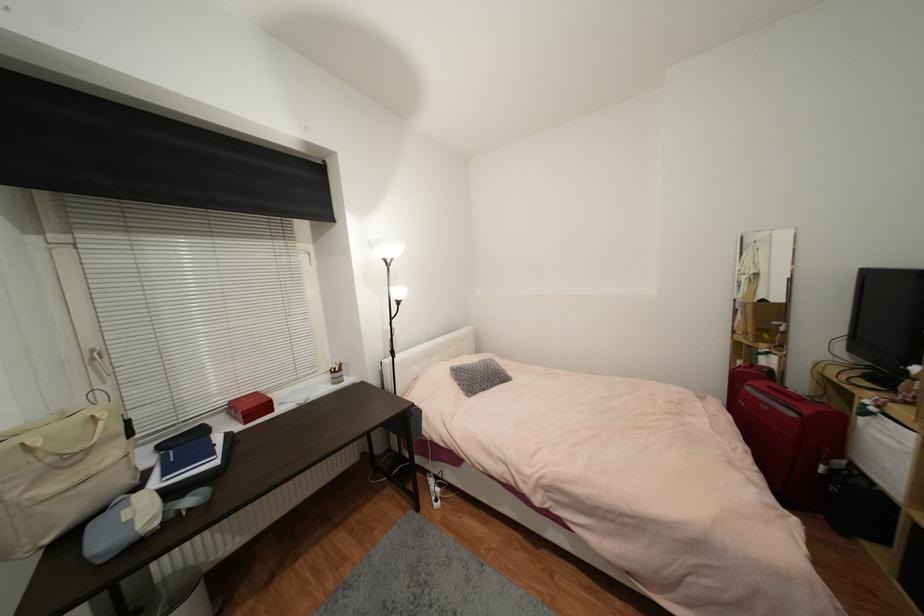
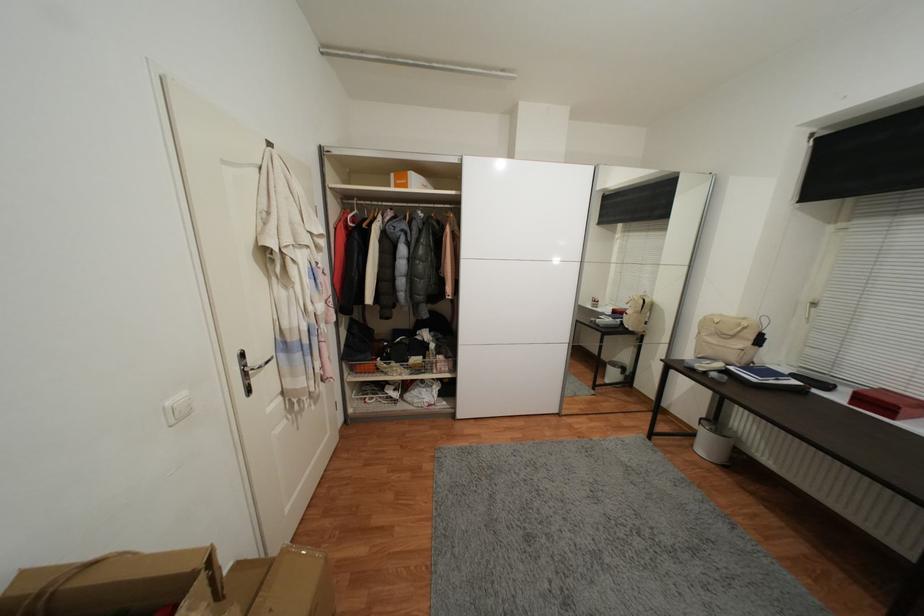
Where in the second image is the point corresponding to (x=276, y=411) from the first image?

(897, 419)